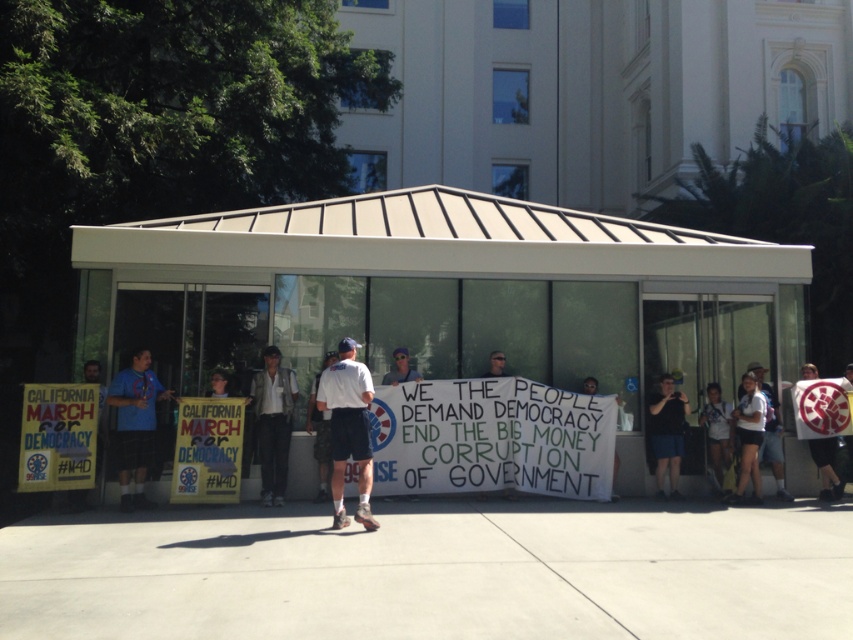
You are a photographer trying to capture a clear photo of both the white fabric shirt at center and the white fabric shirt at lower right. Which shirt should you focus on first to ensure it appears larger in the photo?

You should focus on the white fabric shirt at center first because it is larger in size than the white fabric shirt at lower right, so capturing it first ensures it appears larger in the photo.

In the scene shown: You are a photographer standing in front of the modern building with large glass windows and a flat roof. You want to take a photo that includes both the white cotton shirt at center and the white fabric shirt at lower right. Which shirt should you focus on first to ensure both are in the frame?

You should focus on the white cotton shirt at center first since it is closer to the viewer than the white fabric shirt at lower right, ensuring both are in the frame by adjusting the camera angle to include the background shirt as well.